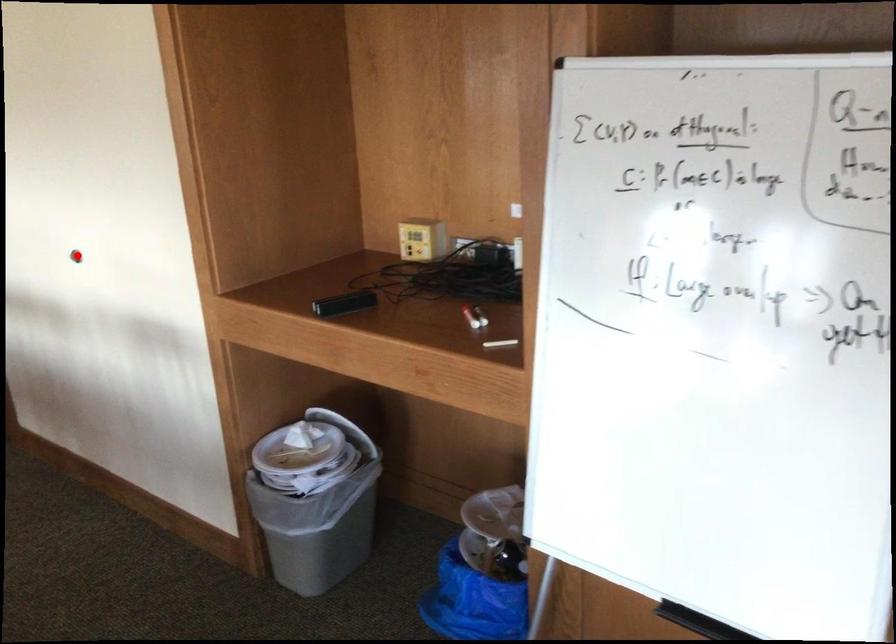
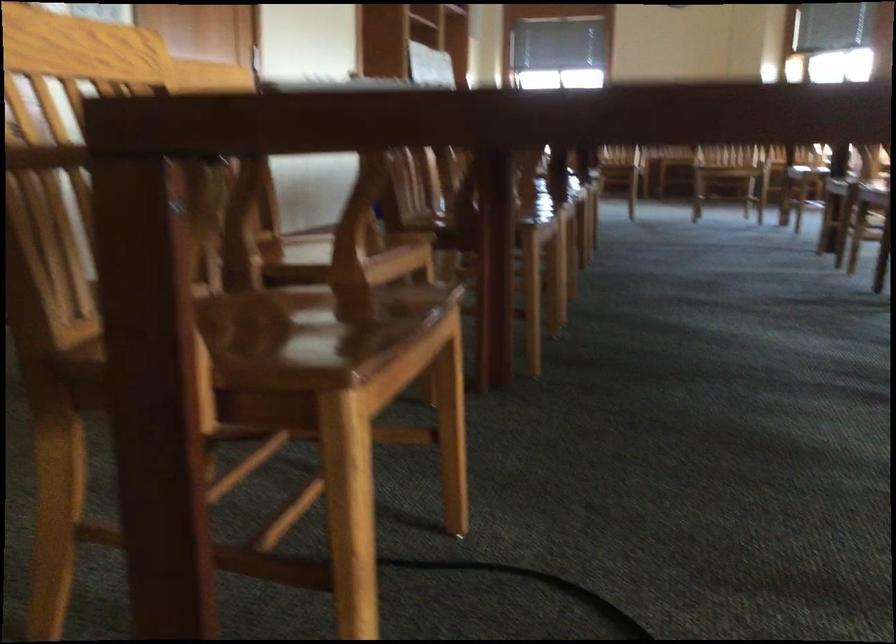
Question: I am providing you with two images of the same scene from different viewpoints. A red point is marked on the first image. At the location where the point appears in image 1, is it still visible in image 2?

Choices:
 (A) Yes
 (B) No

Answer: (B)